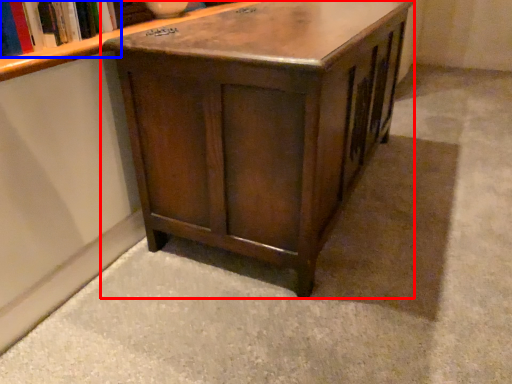
Question: Which object appears farthest to the camera in this image, table (highlighted by a red box) or book (highlighted by a blue box)?

Choices:
 (A) table
 (B) book

Answer: (B)